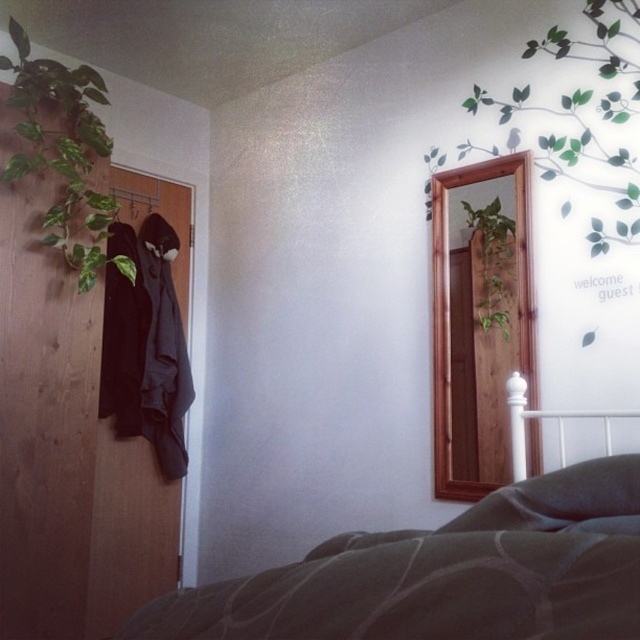
Does dark green textured bedspread at lower center appear on the right side of green matte plant at upper left?

Correct, you'll find dark green textured bedspread at lower center to the right of green matte plant at upper left.

Can you confirm if dark green textured bedspread at lower center is bigger than green matte plant at upper left?

Indeed, dark green textured bedspread at lower center has a larger size compared to green matte plant at upper left.

Image resolution: width=640 pixels, height=640 pixels. What do you see at coordinates (445, 573) in the screenshot? I see `dark green textured bedspread at lower center` at bounding box center [445, 573].

Image resolution: width=640 pixels, height=640 pixels. What are the coordinates of `dark green textured bedspread at lower center` in the screenshot? It's located at (445, 573).

Is point (81, 218) positioned before point (509, 253)?

No, (81, 218) is behind (509, 253).

Who is more forward, (67,176) or (497,284)?

Point (67,176)

In order to click on green matte plant at upper left in this screenshot , I will do `click(65, 154)`.

Who is higher up, green matte plant at upper right or green matte plant at center?

green matte plant at upper right

Does green matte plant at upper right have a greater height compared to green matte plant at center?

Yes, green matte plant at upper right is taller than green matte plant at center.

The height and width of the screenshot is (640, 640). What are the coordinates of `green matte plant at upper right` in the screenshot? It's located at (586, 113).